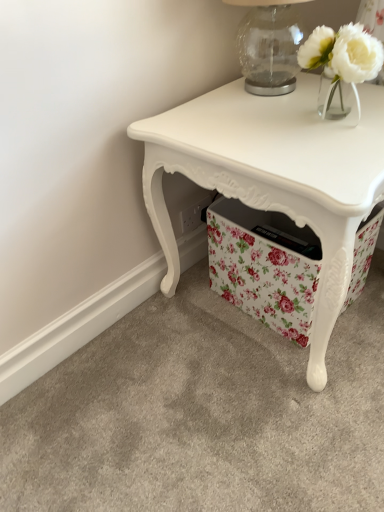
This screenshot has height=512, width=384. I want to click on vacant space positioned to the left of white glossy table at center, so click(x=130, y=374).